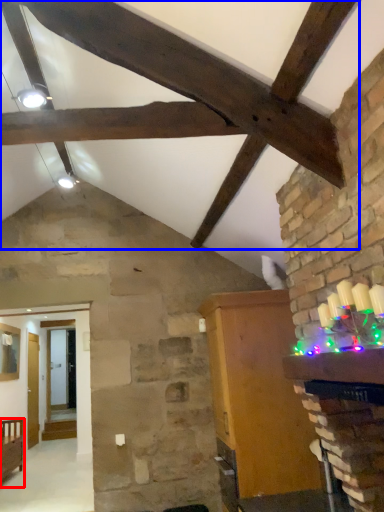
Question: Which object appears farthest to the camera in this image, furniture (highlighted by a red box) or exhaust hood (highlighted by a blue box)?

Choices:
 (A) furniture
 (B) exhaust hood

Answer: (A)